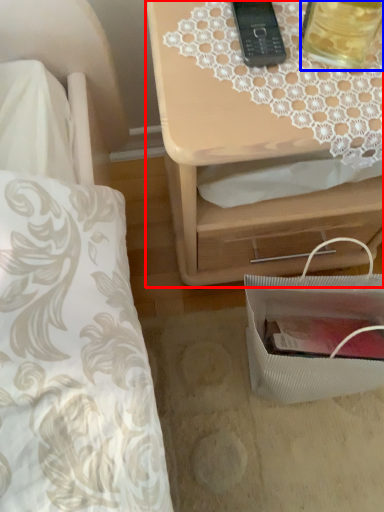
Question: Among these objects, which one is farthest to the camera, nightstand (highlighted by a red box) or beverage (highlighted by a blue box)?

Choices:
 (A) nightstand
 (B) beverage

Answer: (A)